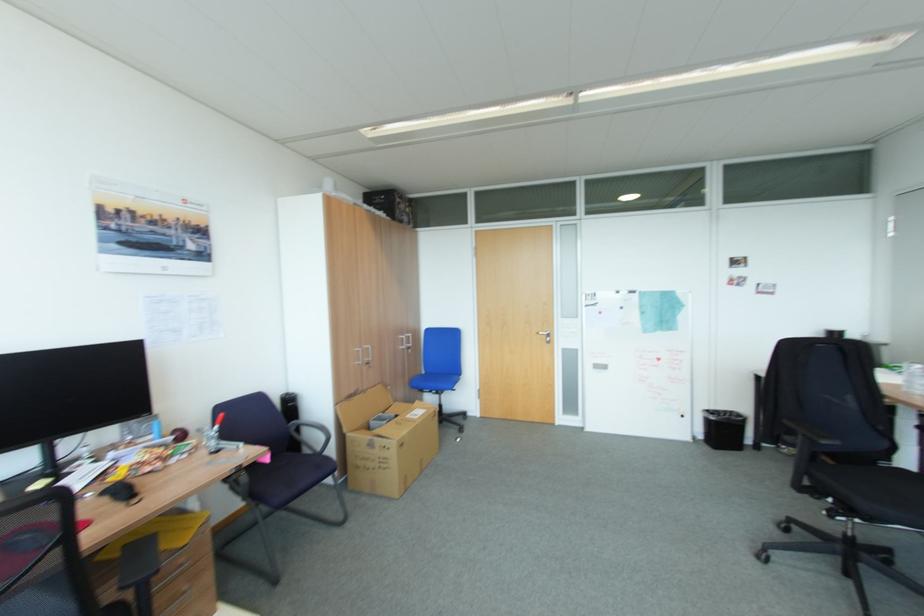
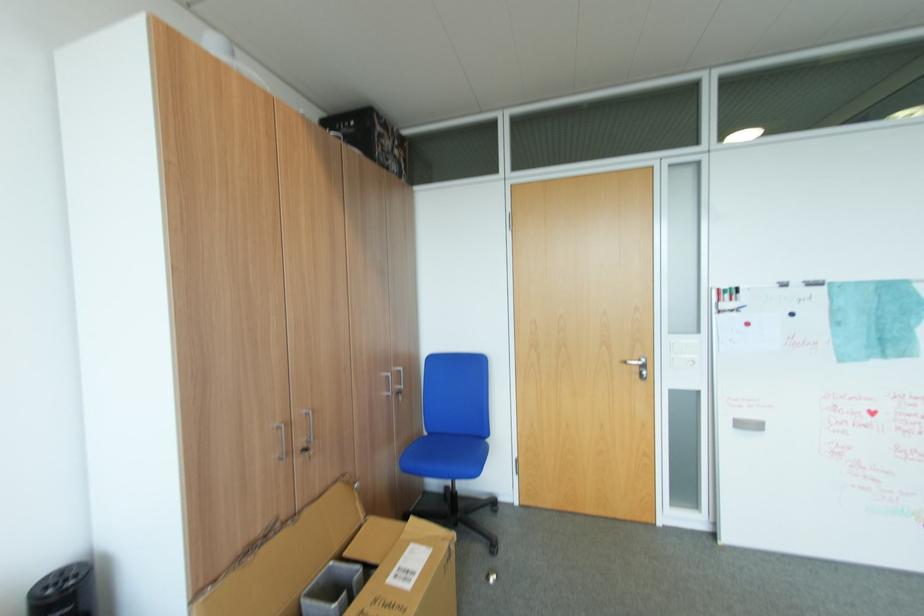
Where in the second image is the point corresponding to (x=439, y=410) from the first image?

(451, 544)